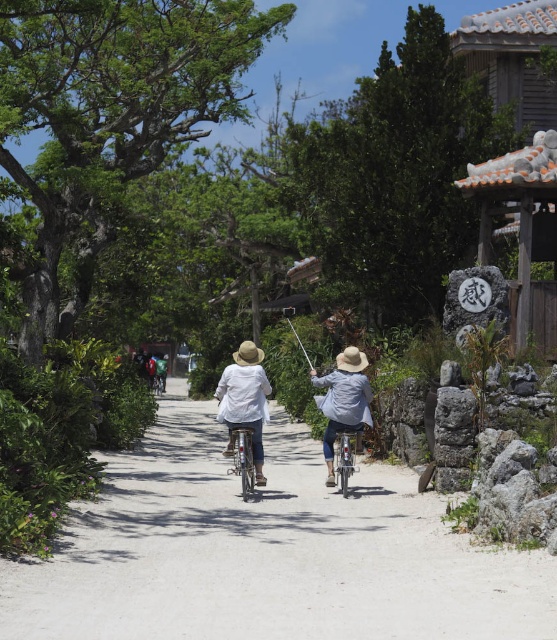
You are planning to take a photo of the scene. The white cotton shirt at center and the metallic silver fishing pole at center are both in the frame. Which object would appear smaller in the photo?

The white cotton shirt at center would appear smaller in the photo because it has a smaller size compared to the metallic silver fishing pole at center.

You are a photographer standing at the edge of the sandy pathway. You want to capture a photo of the green fabric backpack at center and the green fabric jacket at center without any obstructions. Given that your camera has a maximum focus range of 30 inches, will you be able to focus on both items clearly?

The distance between the green fabric backpack at center and the green fabric jacket at center is 33.77 inches, which exceeds the camera maximum focus range of 30 inches. Therefore, you cannot focus on both items clearly.

You are standing at the starting point of the sandy pathway and see the two cyclists ahead. Which cyclist is wearing a white cotton shirt at center? Please describe their position relative to the point marked at coordinate (245, 401).

The white cotton shirt at center is located exactly at the point marked at coordinate (245, 401).